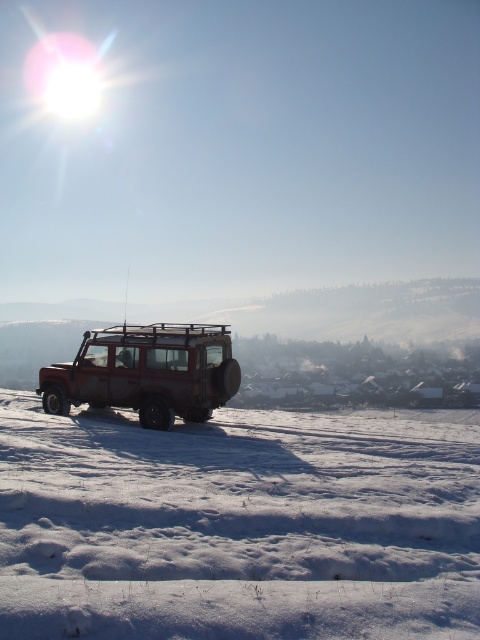
You are standing in the winter landscape scene and want to place a small flag exactly halfway between point (x=278, y=424) and point (x=133, y=330). Will the flag be closer to the camera or farther away compared to the average distance of the two points?

The flag placed halfway between point (x=278, y=424) and point (x=133, y=330) will be closer to the camera than the average distance because point (x=278, y=424) is further to the camera than point (x=133, y=330).

You are a hiker planning to cross the area between the white powdery snow at center and the rusty metal jeep at center. The path is straight. Your backpack has a weight limit of 20 pounds. If you carry a 15 pound gear, will you be able to safely traverse the 8.01 feet distance?

The distance between the white powdery snow at center and the rusty metal jeep at center is 8.01 feet. Since the backpack with 15 pounds is under the 20 pound limit, you can safely traverse the distance.

You are standing at the origin point of the coordinate system. You want to walk to the white powdery snow at center. In which direction should you move?

The white powdery snow at center is located at coordinate point (238, 524). Since the x coordinate is greater than 0.5 and the y coordinate is approximately 0.5, you should move towards the right and slightly forward direction to reach it.